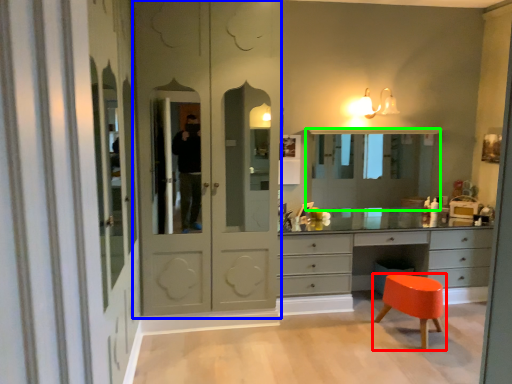
Question: Which object is the closest to the stool (highlighted by a red box)? Choose among these: screen door (highlighted by a blue box) or medicine cabinet (highlighted by a green box).

Choices:
 (A) screen door
 (B) medicine cabinet

Answer: (B)